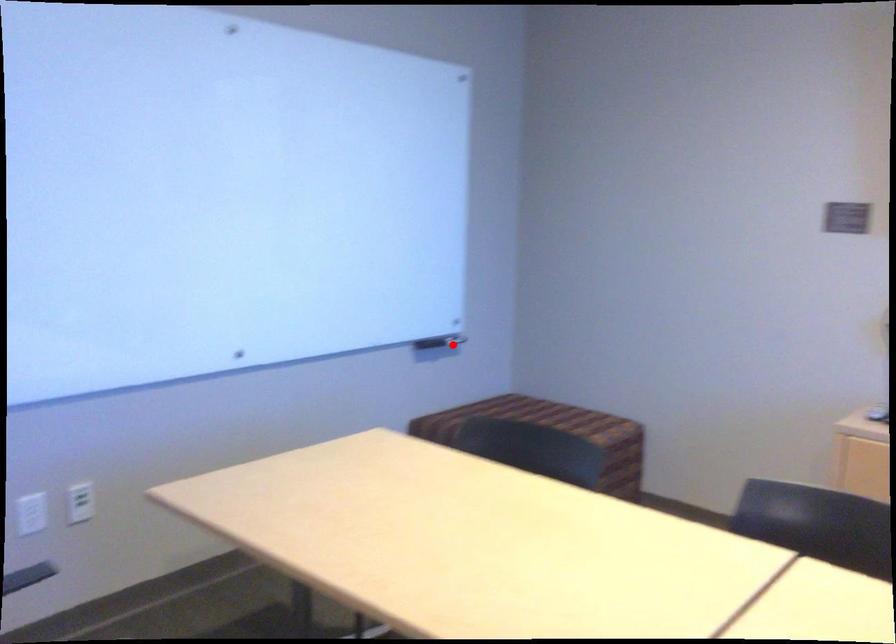
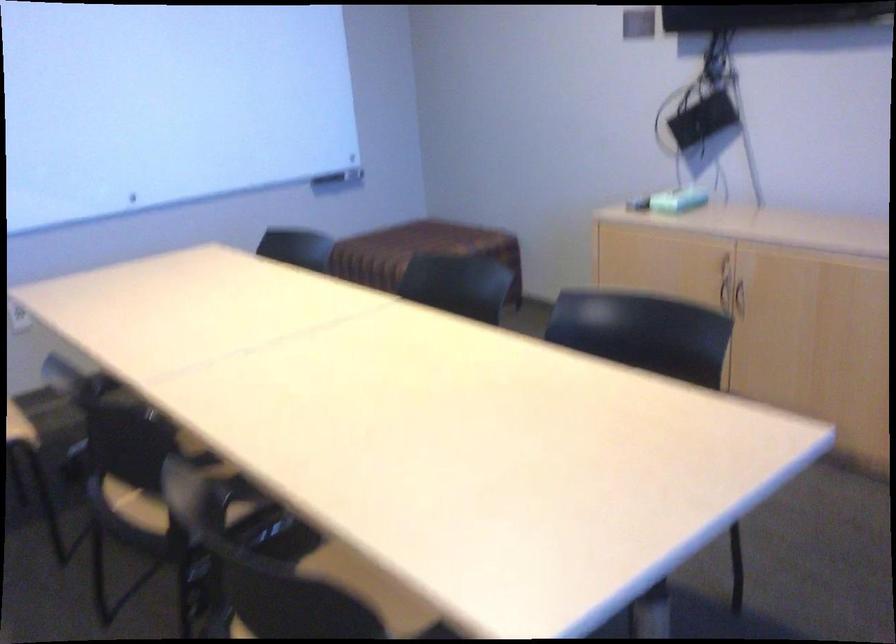
Find the pixel in the second image that matches the highlighted location in the first image.

(339, 178)